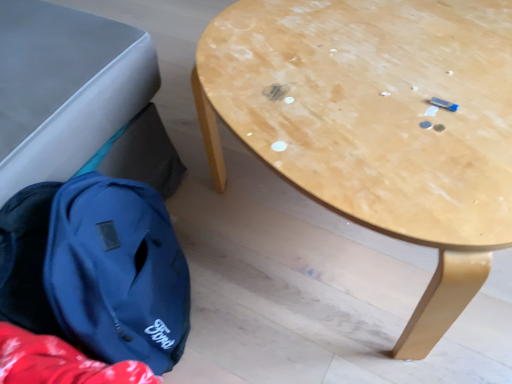
What is the approximate width of matte blue backpack at lower left?

matte blue backpack at lower left is 12.35 inches in width.

Image resolution: width=512 pixels, height=384 pixels. What do you see at coordinates (96, 269) in the screenshot?
I see `matte blue backpack at lower left` at bounding box center [96, 269].

The image size is (512, 384). I want to click on matte blue backpack at lower left, so click(x=96, y=269).

The height and width of the screenshot is (384, 512). What do you see at coordinates (377, 124) in the screenshot? I see `light brown wood table at center` at bounding box center [377, 124].

Locate an element on the screen. The width and height of the screenshot is (512, 384). light brown wood table at center is located at coordinates (377, 124).

Image resolution: width=512 pixels, height=384 pixels. Identify the location of matte blue backpack at lower left. (96, 269).

In the scene shown: Visually, is matte blue backpack at lower left positioned to the left or to the right of light brown wood table at center?

matte blue backpack at lower left is positioned on light brown wood table at center's left side.

Which is behind, matte blue backpack at lower left or light brown wood table at center?

matte blue backpack at lower left is behind.

Considering the positions of point (34, 295) and point (374, 62), is point (34, 295) closer or farther from the camera than point (374, 62)?

Point (34, 295).

From the image's perspective, between matte blue backpack at lower left and light brown wood table at center, which one is located above?

light brown wood table at center.

From a real-world perspective, relative to light brown wood table at center, is matte blue backpack at lower left vertically above or below?

matte blue backpack at lower left is situated lower than light brown wood table at center in the real world.

Considering the relative sizes of matte blue backpack at lower left and light brown wood table at center in the image provided, is matte blue backpack at lower left wider than light brown wood table at center?

No, matte blue backpack at lower left is not wider than light brown wood table at center.

Between matte blue backpack at lower left and light brown wood table at center, which one has more height?

With more height is light brown wood table at center.

Considering the relative sizes of matte blue backpack at lower left and light brown wood table at center in the image provided, is matte blue backpack at lower left bigger than light brown wood table at center?

Actually, matte blue backpack at lower left might be smaller than light brown wood table at center.

Would you say matte blue backpack at lower left is inside or outside light brown wood table at center?

matte blue backpack at lower left is located beyond the bounds of light brown wood table at center.

Consider the image. Are matte blue backpack at lower left and light brown wood table at center located far from each other?

They are positioned close to each other.

Is matte blue backpack at lower left turned away from light brown wood table at center?

No, matte blue backpack at lower left's orientation is not away from light brown wood table at center.

Can you tell me how much matte blue backpack at lower left and light brown wood table at center differ in facing direction?

66.8 degrees separate the facing orientations of matte blue backpack at lower left and light brown wood table at center.

Consider the image. Measure the distance between matte blue backpack at lower left and light brown wood table at center.

matte blue backpack at lower left is 16.39 inches from light brown wood table at center.

Where is `table that appears above the matte blue backpack at lower left (from the image's perspective)`? The width and height of the screenshot is (512, 384). table that appears above the matte blue backpack at lower left (from the image's perspective) is located at coordinates (377, 124).

Is light brown wood table at center at the right side of matte blue backpack at lower left?

Correct, you'll find light brown wood table at center to the right of matte blue backpack at lower left.

Which is in front, light brown wood table at center or matte blue backpack at lower left?

light brown wood table at center.

From the picture: Which is nearer, (300, 94) or (127, 322)?

Point (300, 94) is closer to the camera than point (127, 322).

Looking at this image, from the image's perspective, is light brown wood table at center located above matte blue backpack at lower left?

Yes.

From a real-world perspective, is light brown wood table at center positioned over matte blue backpack at lower left based on gravity?

Yes, from a real-world perspective, light brown wood table at center is on top of matte blue backpack at lower left.

Considering the sizes of objects light brown wood table at center and matte blue backpack at lower left in the image provided, who is wider, light brown wood table at center or matte blue backpack at lower left?

With larger width is light brown wood table at center.

Considering the relative sizes of light brown wood table at center and matte blue backpack at lower left in the image provided, is light brown wood table at center shorter than matte blue backpack at lower left?

In fact, light brown wood table at center may be taller than matte blue backpack at lower left.

Considering the sizes of objects light brown wood table at center and matte blue backpack at lower left in the image provided, who is bigger, light brown wood table at center or matte blue backpack at lower left?

With larger size is light brown wood table at center.

Would you say light brown wood table at center is outside matte blue backpack at lower left?

Yes, light brown wood table at center is not within matte blue backpack at lower left.

Are light brown wood table at center and matte blue backpack at lower left beside each other?

light brown wood table at center is not next to matte blue backpack at lower left, and they're not touching.

Does light brown wood table at center turn towards matte blue backpack at lower left?

No, light brown wood table at center does not turn towards matte blue backpack at lower left.

The image size is (512, 384). I want to click on table above the matte blue backpack at lower left (from the image's perspective), so click(x=377, y=124).

Image resolution: width=512 pixels, height=384 pixels. I want to click on table on the right of matte blue backpack at lower left, so click(x=377, y=124).

Find the location of a particular element. Image resolution: width=512 pixels, height=384 pixels. table in front of the matte blue backpack at lower left is located at coordinates (377, 124).